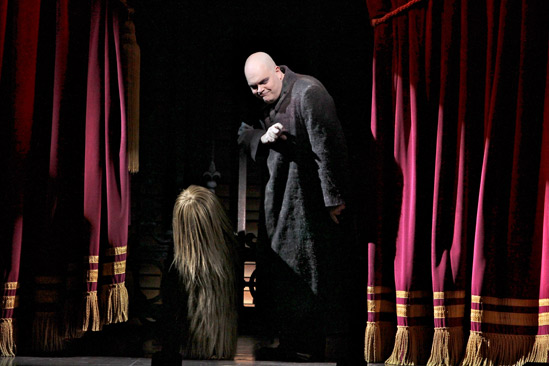
Identify the location of curtain. The image size is (549, 366). (430, 98), (106, 109).